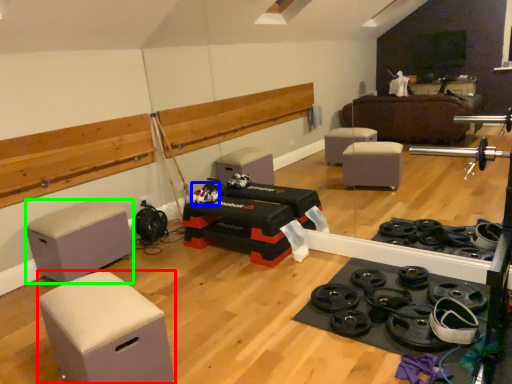
Question: Which object is positioned closest to furniture (highlighted by a red box)? Select from toy (highlighted by a blue box) and furniture (highlighted by a green box).

Choices:
 (A) toy
 (B) furniture

Answer: (B)